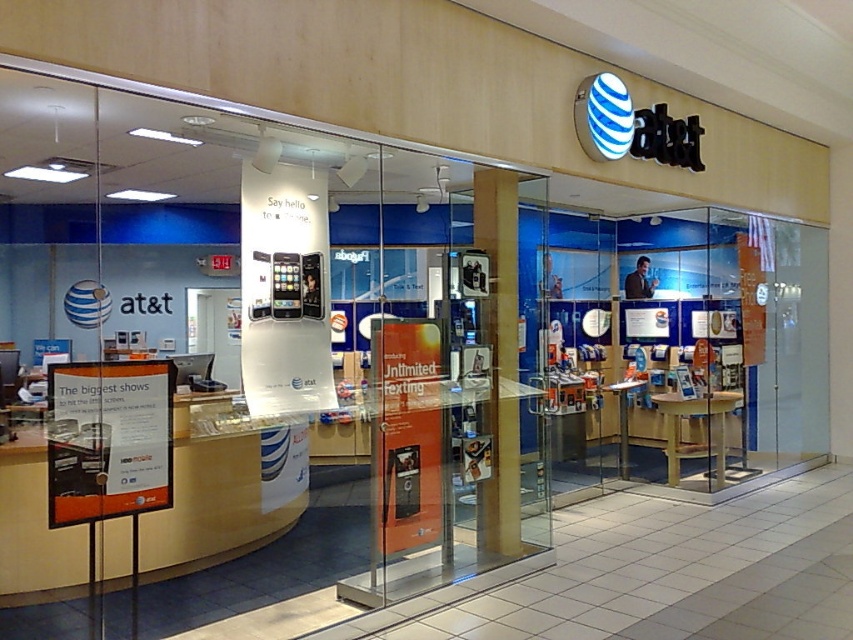
Question: Is blue glass display at center to the right of wooden pillar at center from the viewer's perspective?

Choices:
 (A) no
 (B) yes

Answer: (B)

Question: Is blue glass display at center smaller than wooden pillar at center?

Choices:
 (A) no
 (B) yes

Answer: (A)

Question: Which of the following is the farthest from the observer?

Choices:
 (A) (506, 536)
 (B) (776, 467)

Answer: (B)

Question: Does blue glass display at center appear on the left side of wooden pillar at center?

Choices:
 (A) yes
 (B) no

Answer: (B)